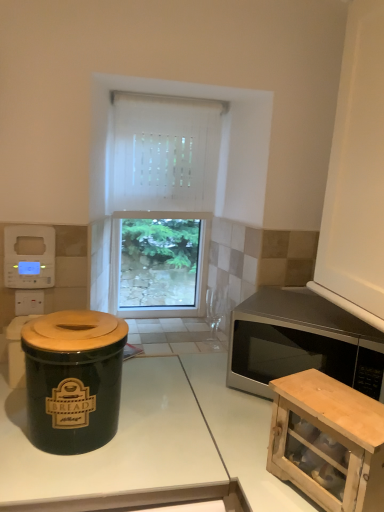
Question: Is white plastic digital clock at upper left positioned with its back to satin silver microwave at right?

Choices:
 (A) yes
 (B) no

Answer: (B)

Question: Is white plastic digital clock at upper left positioned before satin silver microwave at right?

Choices:
 (A) no
 (B) yes

Answer: (A)

Question: Considering the relative positions of white plastic digital clock at upper left and satin silver microwave at right in the image provided, is white plastic digital clock at upper left behind satin silver microwave at right?

Choices:
 (A) yes
 (B) no

Answer: (A)

Question: From a real-world perspective, is white plastic digital clock at upper left located higher than satin silver microwave at right?

Choices:
 (A) no
 (B) yes

Answer: (B)

Question: Is white plastic digital clock at upper left far from satin silver microwave at right?

Choices:
 (A) yes
 (B) no

Answer: (B)

Question: Is white plastic digital clock at upper left to the left or to the right of satin silver microwave at right in the image?

Choices:
 (A) left
 (B) right

Answer: (A)

Question: From a real-world perspective, is white plastic digital clock at upper left positioned above or below satin silver microwave at right?

Choices:
 (A) above
 (B) below

Answer: (A)

Question: From the image's perspective, is white plastic digital clock at upper left above or below satin silver microwave at right?

Choices:
 (A) below
 (B) above

Answer: (B)

Question: Is white plastic digital clock at upper left inside or outside of satin silver microwave at right?

Choices:
 (A) inside
 (B) outside

Answer: (B)

Question: Is wooden cabinet at lower right wider or thinner than white glossy countertop at center?

Choices:
 (A) thin
 (B) wide

Answer: (A)

Question: Is point (306, 426) positioned closer to the camera than point (153, 477)?

Choices:
 (A) farther
 (B) closer

Answer: (A)

Question: In the image, is wooden cabinet at lower right positioned in front of or behind white glossy countertop at center?

Choices:
 (A) behind
 (B) front

Answer: (B)

Question: From their relative heights in the image, would you say wooden cabinet at lower right is taller or shorter than white glossy countertop at center?

Choices:
 (A) short
 (B) tall

Answer: (A)

Question: Is satin silver microwave at right wider or thinner than white plastic digital clock at upper left?

Choices:
 (A) thin
 (B) wide

Answer: (B)

Question: In the image, is satin silver microwave at right positioned in front of or behind white plastic digital clock at upper left?

Choices:
 (A) front
 (B) behind

Answer: (A)